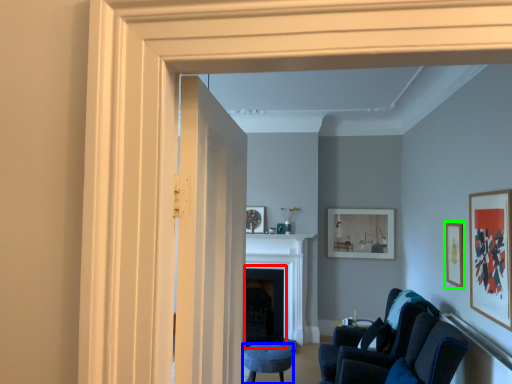
Question: Based on their relative distances, which object is farther from fireplace (highlighted by a red box)? Choose from furniture (highlighted by a blue box) and picture frame (highlighted by a green box).

Choices:
 (A) furniture
 (B) picture frame

Answer: (B)